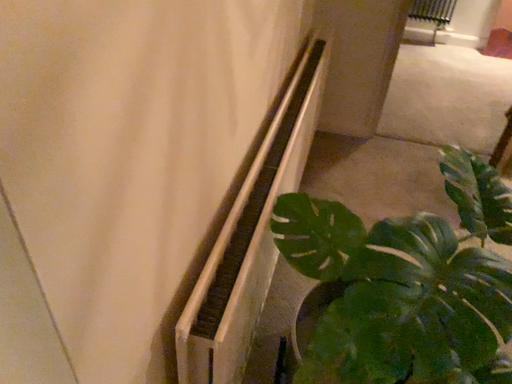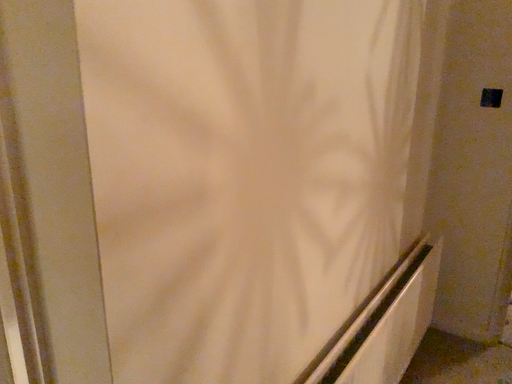
Question: Which way did the camera rotate in the video?

Choices:
 (A) rotated upward
 (B) rotated downward

Answer: (A)